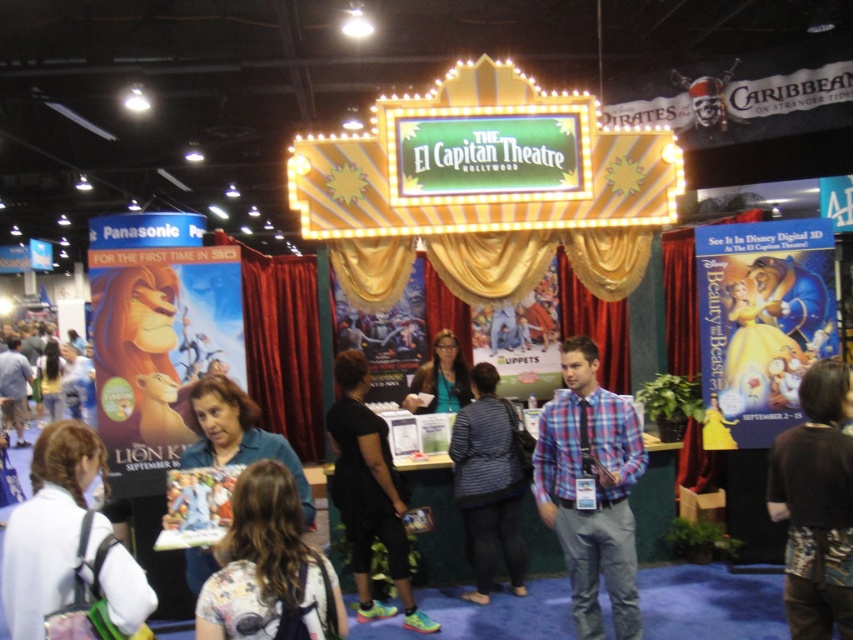
In the scene shown: You are a photographer at the event and need to capture a photo of both the brown fabric pants at lower right and the white fabric backpack at lower left in the same frame. Your camera has a maximum focus range of 3 meters. Can you fit both items into the frame without moving your position?

The distance between the brown fabric pants at lower right and the white fabric backpack at lower left is 3.03 meters. Since your camera can only focus up to 3 meters, you cannot fit both items into the frame without moving closer or adjusting your position.